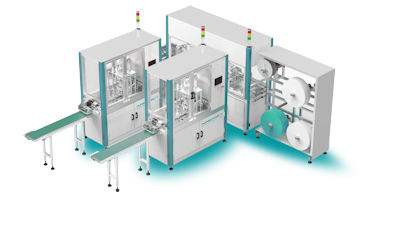
Image resolution: width=400 pixels, height=227 pixels. In order to click on cupboard handles in this screenshot , I will do `click(198, 135)`, `click(132, 117)`.